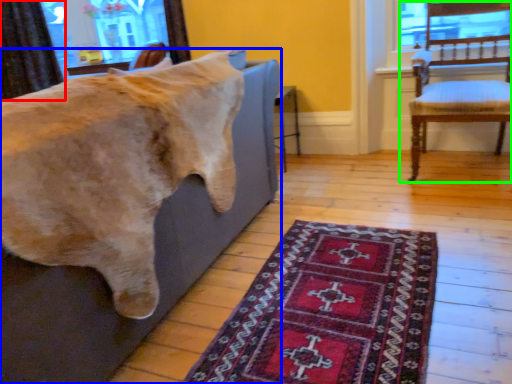
Question: Estimate the real-world distances between objects in this image. Which object is closer to curtain (highlighted by a red box), furniture (highlighted by a blue box) or chair (highlighted by a green box)?

Choices:
 (A) furniture
 (B) chair

Answer: (A)